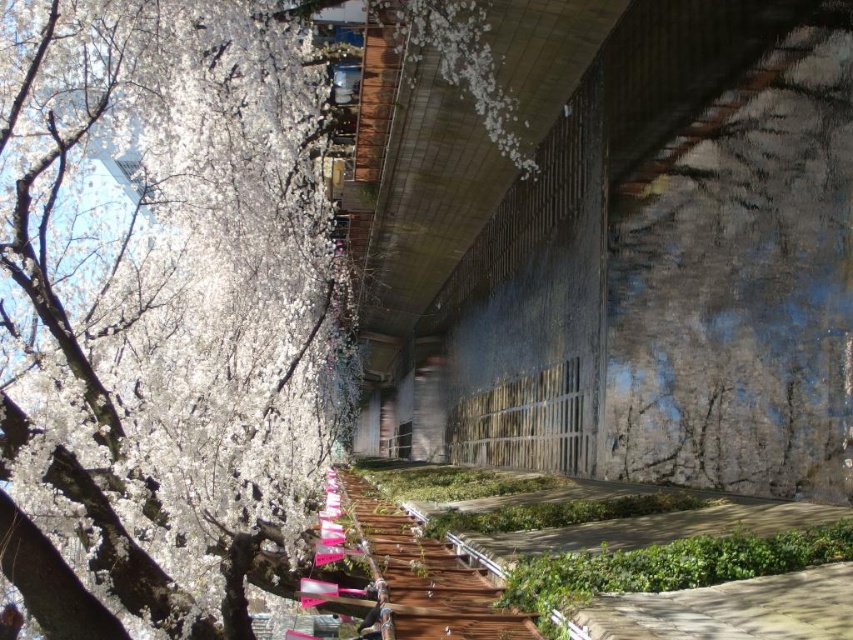
Question: Does white blossoms at left appear on the left side of wooden walkway at center?

Choices:
 (A) no
 (B) yes

Answer: (B)

Question: Is white blossoms at left to the right of wooden walkway at center from the viewer's perspective?

Choices:
 (A) no
 (B) yes

Answer: (A)

Question: From the image, what is the correct spatial relationship of white blossoms at left in relation to wooden walkway at center?

Choices:
 (A) above
 (B) below

Answer: (A)

Question: Which point is closer to the camera?

Choices:
 (A) (453, 572)
 (B) (13, 180)

Answer: (A)